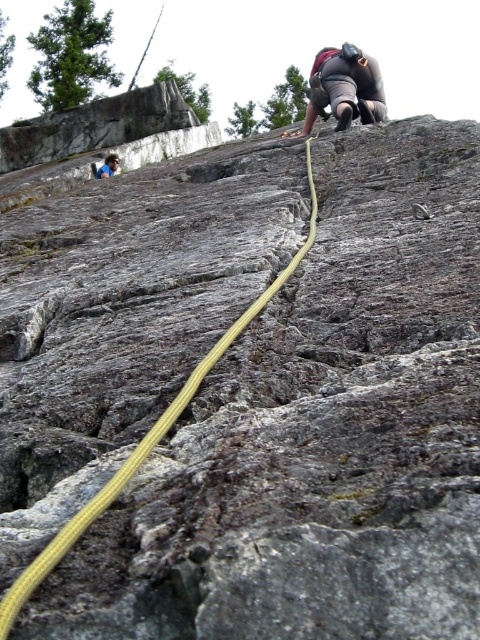
Image resolution: width=480 pixels, height=640 pixels. Find the location of `matte black harness at upper center`. matte black harness at upper center is located at coordinates (345, 88).

Which of these two, matte black harness at upper center or blue fabric shirt at upper left, stands shorter?

blue fabric shirt at upper left

Who is more forward, (372, 67) or (112, 164)?

Point (372, 67) is in front.

Find the location of a particular element. The height and width of the screenshot is (640, 480). matte black harness at upper center is located at coordinates (345, 88).

Who is positioned more to the right, yellow braided rope at center or blue fabric shirt at upper left?

yellow braided rope at center is more to the right.

Between yellow braided rope at center and blue fabric shirt at upper left, which one is positioned lower?

yellow braided rope at center is lower down.

You are a GUI agent. You are given a task and a screenshot of the screen. Output one action in this format:
    pyautogui.click(x=<x>, y=<y>)
    Task: Click on the yellow braided rope at center
    The height and width of the screenshot is (640, 480).
    Given the screenshot: What is the action you would take?
    pyautogui.click(x=143, y=442)

Locate an element on the screen. Image resolution: width=480 pixels, height=640 pixels. yellow braided rope at center is located at coordinates (143, 442).

Which of these two, yellow braided rope at center or matte black harness at upper center, stands taller?

Standing taller between the two is matte black harness at upper center.

Does yellow braided rope at center come in front of matte black harness at upper center?

Yes, yellow braided rope at center is in front of matte black harness at upper center.

Is point (36, 563) positioned behind point (373, 61)?

No.

This screenshot has height=640, width=480. In order to click on yellow braided rope at center in this screenshot , I will do (x=143, y=442).